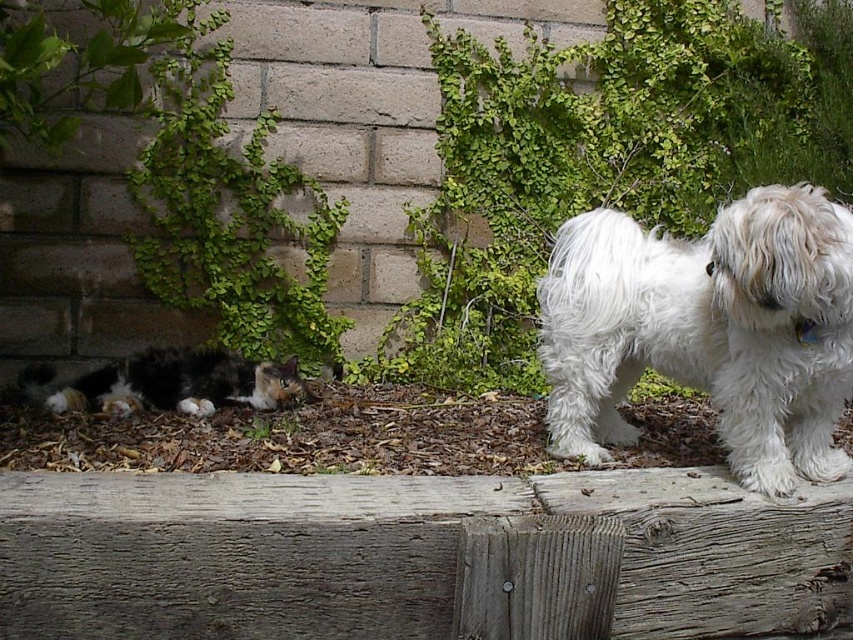
From the picture: Does white fluffy dog at right have a lesser height compared to calico fur cat at lower left?

No, white fluffy dog at right is not shorter than calico fur cat at lower left.

Which of these two, white fluffy dog at right or calico fur cat at lower left, stands taller?

white fluffy dog at right is taller.

Measure the distance between point (567,376) and camera.

A distance of 2.79 meters exists between point (567,376) and camera.

Find the location of a particular element. The height and width of the screenshot is (640, 853). white fluffy dog at right is located at coordinates (706, 330).